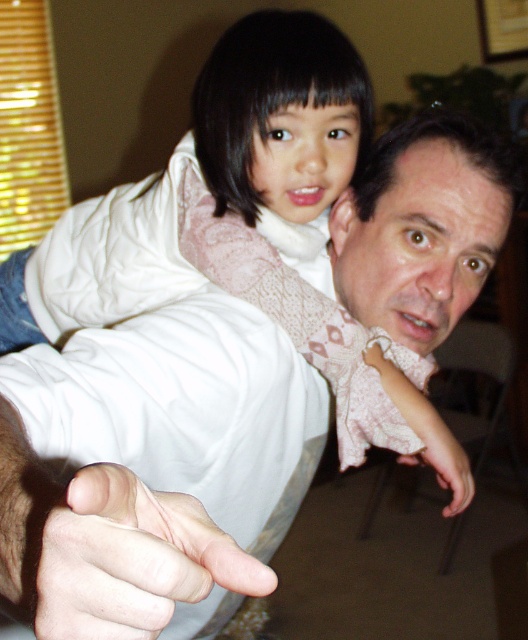
You are a photographer setting up for a family portrait. You notice the white matte hand at center and the pink lace sleeve at upper center in the scene. To ensure both elements are in focus, what is the minimum distance you need to maintain between them for proper depth of field?

The white matte hand at center and the pink lace sleeve at upper center are 29.07 inches apart from each other. To ensure both are in focus, the photographer should maintain a distance of at least 29.07 inches between them.

You are an artist trying to sketch this scene. You need to determine which of the two points, point (174,541) or point (449,477), should be drawn first to maintain perspective. Based on their positions, which point is closer to you?

Point (174,541) is closer to the viewer than point (449,477), so you should draw point (174,541) first to maintain perspective.

You are a photographer trying to capture the white matte hand at center and the pink lace sleeve at upper center in a photo. Which object is covering part of the other in the image?

The white matte hand at center is positioned over the pink lace sleeve at upper center, so it is covering part of it.